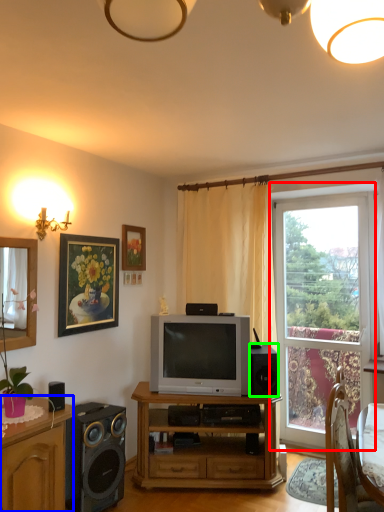
Question: Estimate the real-world distances between objects in this image. Which object is farther from window (highlighted by a red box), cabinetry (highlighted by a blue box) or speaker (highlighted by a green box)?

Choices:
 (A) cabinetry
 (B) speaker

Answer: (A)